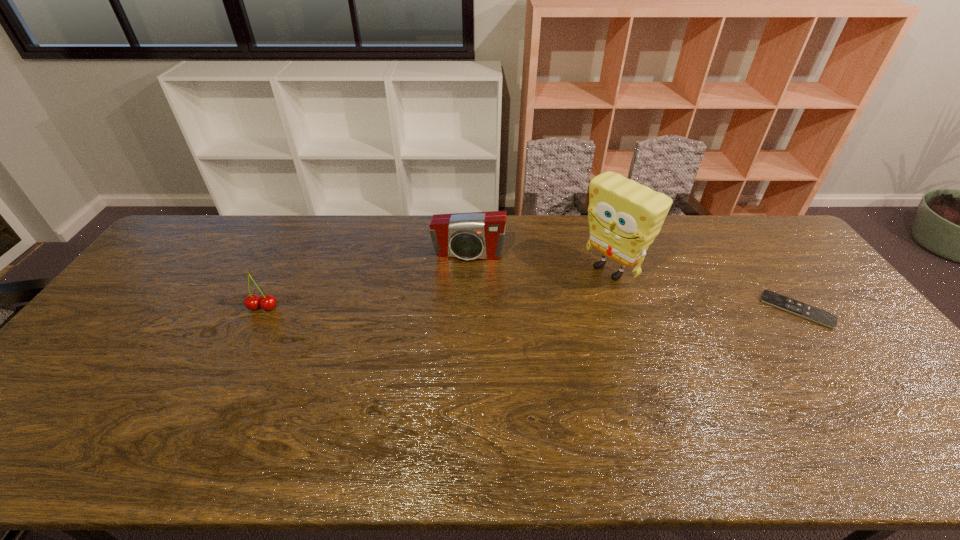
Find the location of a particular element. free spot at the near edge of the desktop is located at coordinates (310, 405).

Locate an element on the screen. Image resolution: width=960 pixels, height=540 pixels. free space at the left edge of the desktop is located at coordinates (179, 264).

In the image, there is a desktop. Where is `free space at the far left corner`? This screenshot has height=540, width=960. free space at the far left corner is located at coordinates (182, 226).

Locate an element on the screen. The height and width of the screenshot is (540, 960). vacant space at the far right corner of the desktop is located at coordinates (752, 235).

Find the location of `free space at the near right corner of the desktop`. free space at the near right corner of the desktop is located at coordinates (908, 390).

In order to click on free spot between the tallest object and the leftmost object in this screenshot , I will do `click(437, 289)`.

Identify the location of free space between the third tallest object and the remote control. (530, 308).

Identify the location of free spot between the sponge and the second tallest object. Image resolution: width=960 pixels, height=540 pixels. [540, 262].

Locate an element on the screen. This screenshot has width=960, height=540. vacant point located between the tallest object and the cherry is located at coordinates 437,289.

Find the location of `empty space between the shortest object and the leftmost object`. empty space between the shortest object and the leftmost object is located at coordinates (530, 308).